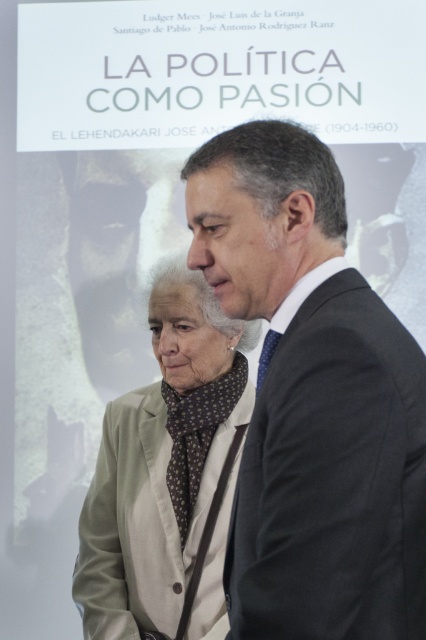
Between dark gray suit at center and brown dotted fabric bow tie at center, which one appears on the right side from the viewer's perspective?

Positioned to the right is dark gray suit at center.

Which of these two, dark gray suit at center or brown dotted fabric bow tie at center, stands taller?

With more height is dark gray suit at center.

You are a GUI agent. You are given a task and a screenshot of the screen. Output one action in this format:
    pyautogui.click(x=<x>, y=<y>)
    Task: Click on the dark gray suit at center
    The height and width of the screenshot is (640, 426).
    Given the screenshot: What is the action you would take?
    pyautogui.click(x=311, y=400)

Which is in front, point (181, 600) or point (184, 442)?

Point (181, 600) is in front.

The height and width of the screenshot is (640, 426). What do you see at coordinates (141, 520) in the screenshot?
I see `light beige fabric business suit at center` at bounding box center [141, 520].

At what (x,y) coordinates should I click in order to perform the action: click on light beige fabric business suit at center. Please return your answer as a coordinate pair (x, y). This screenshot has width=426, height=640. Looking at the image, I should click on (141, 520).

Can you confirm if dark gray suit at center is wider than light beige fabric business suit at center?

Incorrect, dark gray suit at center's width does not surpass light beige fabric business suit at center's.

Which of these two, dark gray suit at center or light beige fabric business suit at center, stands shorter?

Standing shorter between the two is light beige fabric business suit at center.

This screenshot has width=426, height=640. I want to click on dark gray suit at center, so click(311, 400).